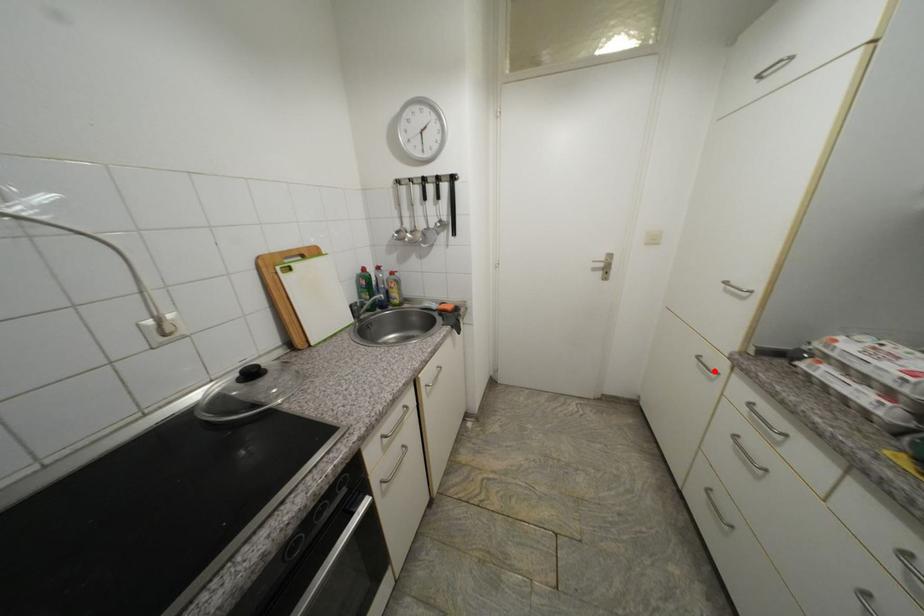
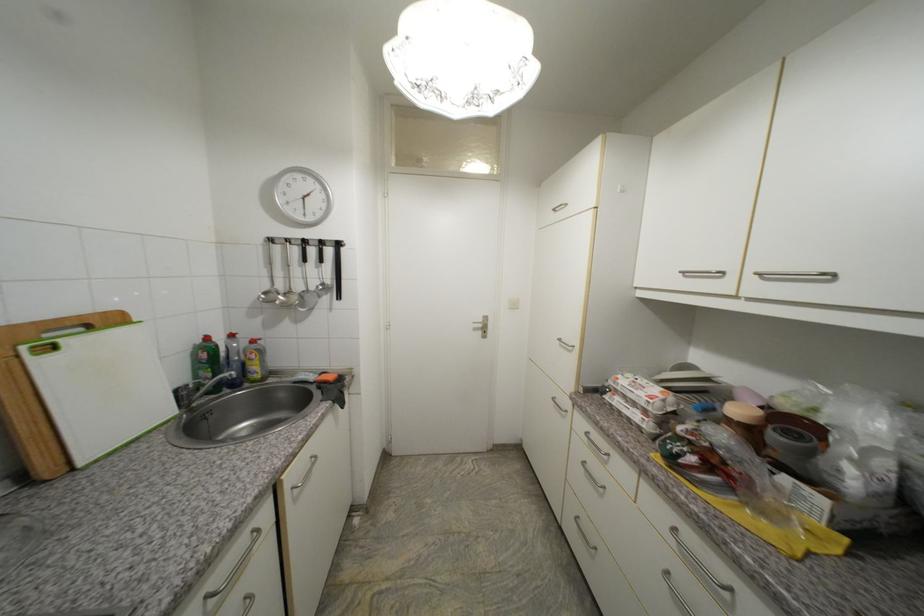
In the second image, find the point that corresponds to the highlighted location in the first image.

(565, 410)